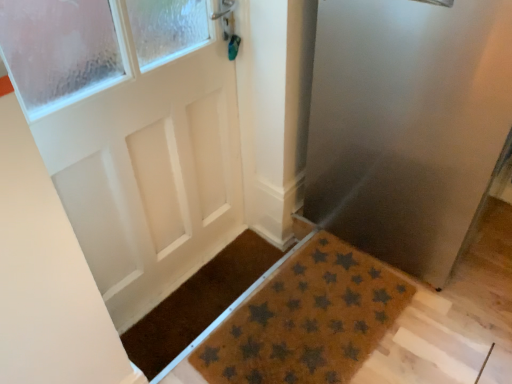
Question: From a real-world perspective, is brown textured mat at lower right physically located above or below brown coir mat with star pattern at lower center, the second doormat viewed from the left?

Choices:
 (A) above
 (B) below

Answer: (A)

Question: Visually, is brown textured mat at lower right positioned to the left or to the right of brown coir mat with star pattern at lower center, the second doormat viewed from the left?

Choices:
 (A) left
 (B) right

Answer: (B)

Question: Which is nearer to the brown coir mat at center, which is the 1th doormat in left-to-right order?

Choices:
 (A) brown textured mat at lower right
 (B) brown coir mat with star pattern at lower center, the first doormat from the right

Answer: (B)

Question: Estimate the real-world distances between objects in this image. Which object is farther from the brown coir mat with star pattern at lower center, the second doormat viewed from the left?

Choices:
 (A) brown textured mat at lower right
 (B) brown coir mat at center, acting as the second doormat starting from the right

Answer: (A)